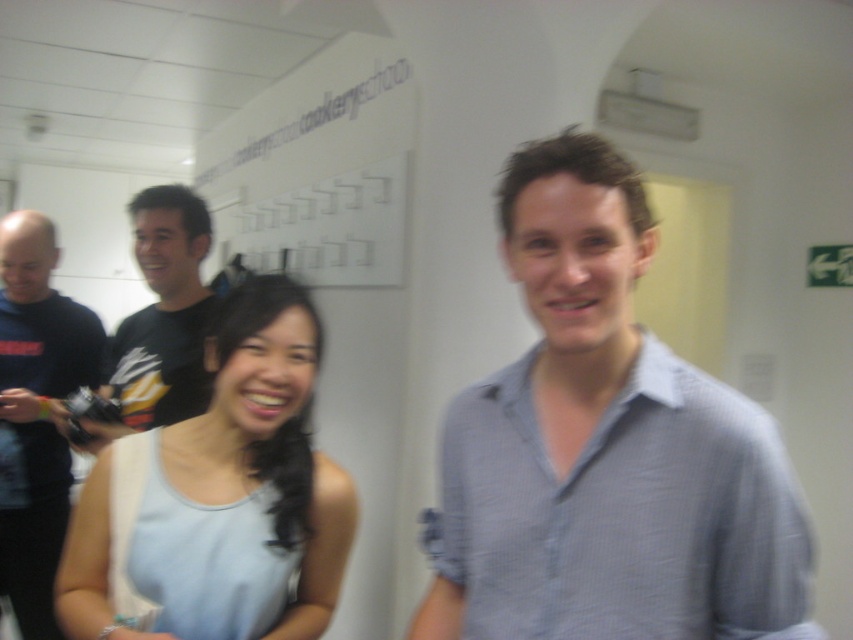
Which is below, light blue fabric dress at center or white matte signboard at upper center?

light blue fabric dress at center is lower down.

Which is more to the left, light blue fabric dress at center or white matte signboard at upper center?

white matte signboard at upper center

Does point (271, 484) come closer to viewer compared to point (305, 188)?

Yes, it is in front of point (305, 188).

Locate an element on the screen. This screenshot has width=853, height=640. light blue fabric dress at center is located at coordinates (219, 499).

Looking at this image, is white matte signboard at upper center thinner than black jersey at center?

No, white matte signboard at upper center is not thinner than black jersey at center.

Who is shorter, white matte signboard at upper center or black jersey at center?

black jersey at center

This screenshot has width=853, height=640. Identify the location of white matte signboard at upper center. (317, 168).

Can you confirm if light blue checkered shirt at center is positioned to the right of light blue fabric dress at center?

Yes, light blue checkered shirt at center is to the right of light blue fabric dress at center.

What do you see at coordinates (604, 449) in the screenshot? This screenshot has width=853, height=640. I see `light blue checkered shirt at center` at bounding box center [604, 449].

Locate an element on the screen. light blue checkered shirt at center is located at coordinates (604, 449).